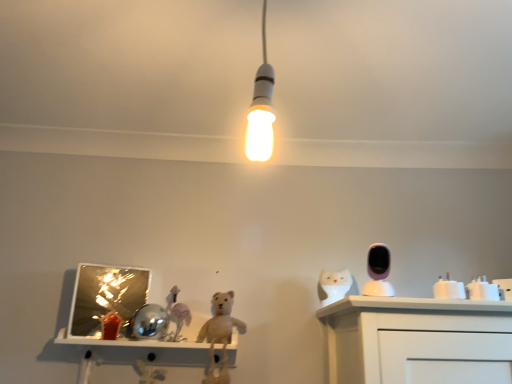
Question: Considering their positions, is matte pink horse at center, acting as the 4th toy starting from the front, located in front of or behind white glossy owl at right?

Choices:
 (A) behind
 (B) front

Answer: (B)

Question: Based on their sizes in the image, would you say matte pink horse at center, acting as the 4th toy starting from the right, is bigger or smaller than white glossy owl at right?

Choices:
 (A) small
 (B) big

Answer: (B)

Question: Estimate the real-world distances between objects in this image. Which object is farther from the matte pink horse at center, placed as the 1th toy when sorted from left to right?

Choices:
 (A) pink glossy security camera at upper right, which ranks as the 1th toy in front-to-back order
 (B) white glossy cup at right, the 2th toy in the right-to-left sequence
 (C) white glossy plug at right, the 4th toy positioned from the left
 (D) white glossy owl at right

Answer: (C)

Question: Based on their relative distances, which object is nearer to the pink glossy security camera at upper right, the fourth toy in the back-to-front sequence?

Choices:
 (A) white glossy cup at right, which is the third toy from back to front
 (B) white glossy plug at right, the 4th toy positioned from the left
 (C) white glossy owl at right
 (D) matte pink horse at center, acting as the 4th toy starting from the right

Answer: (A)